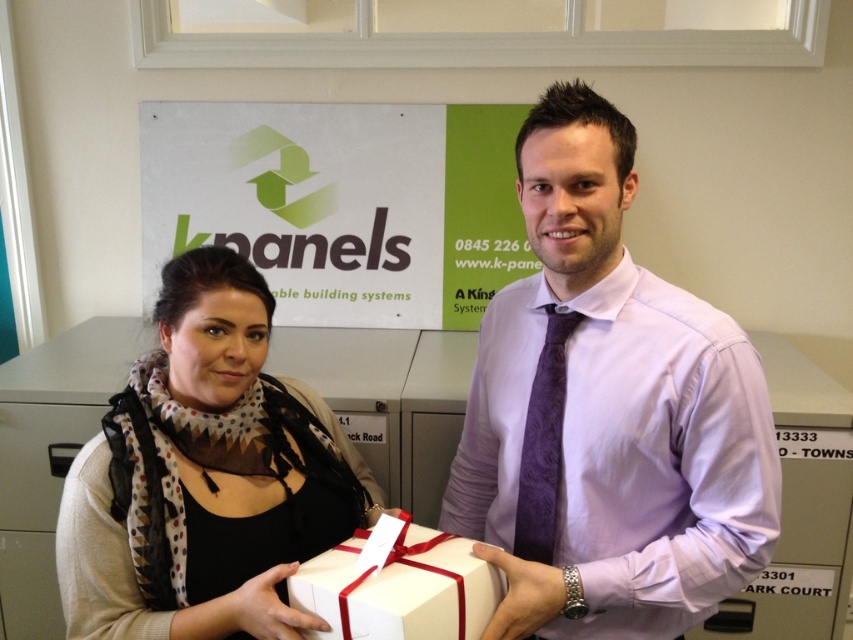
Question: Which object appears farthest from the camera in this image?

Choices:
 (A) green matte signboard at upper center
 (B) black scarf at center

Answer: (A)

Question: Which point is farther to the camera?

Choices:
 (A) tap(717, 340)
 (B) tap(335, 118)

Answer: (B)

Question: Which of these objects is positioned closest to the white matte gift box at center?

Choices:
 (A) green matte signboard at upper center
 (B) black scarf at center
 (C) purple satin shirt at center

Answer: (B)

Question: Does purple satin shirt at center have a lesser width compared to black scarf at center?

Choices:
 (A) yes
 (B) no

Answer: (A)

Question: Is purple satin shirt at center wider than black scarf at center?

Choices:
 (A) yes
 (B) no

Answer: (B)

Question: Can you confirm if black scarf at center is bigger than green matte signboard at upper center?

Choices:
 (A) yes
 (B) no

Answer: (B)